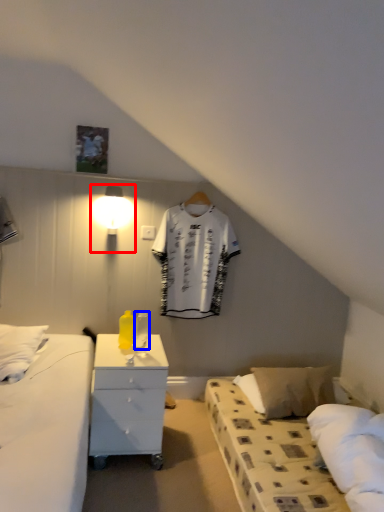
Question: Among these objects, which one is nearest to the camera, light fixture (highlighted by a red box) or bottle (highlighted by a blue box)?

Choices:
 (A) light fixture
 (B) bottle

Answer: (B)